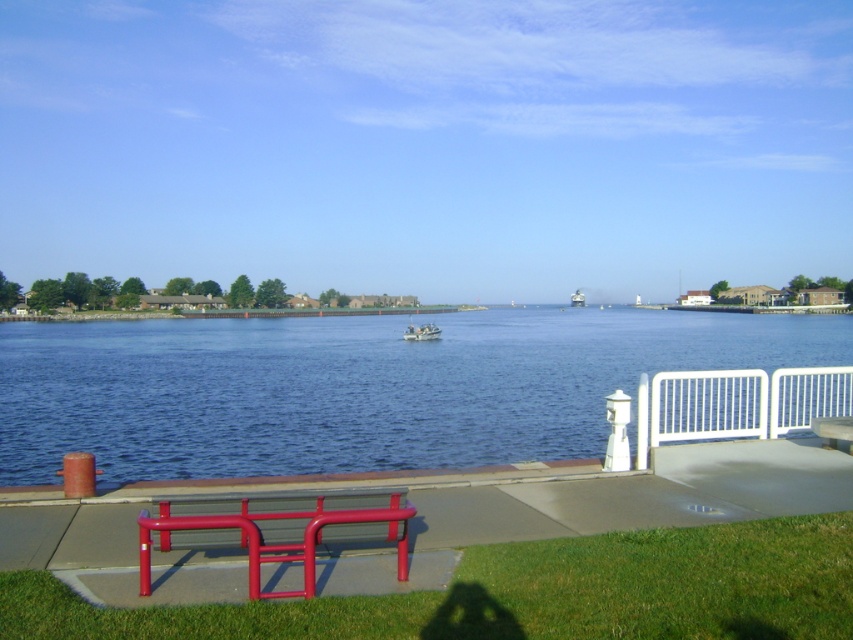
You are standing on the walkway and want to compare the sizes of the white metal fence at right and the white plastic boat at center. Which one takes up more space in the image?

The white plastic boat at center takes up more space in the image than the white metal fence at right because the white metal fence at right occupies less space than the white plastic boat at center.

You are a photographer planning to capture the waterfront scene. You want to ensure that the blue water at center and the white metal fence at right are both visible in your shot. Based on their sizes, which object should you prioritize framing closer to the center of the photo?

The blue water at center is bigger than the white metal fence at right, so you should prioritize framing the blue water at center closer to the center of the photo to ensure it stands out prominently in the composition.

You are standing on the walkway and want to place a new bench exactly where the white plastic boat at center is located. Is this possible given the scene?

The white plastic boat at center is located in the water, so placing a bench there is not possible as the bench would be submerged.